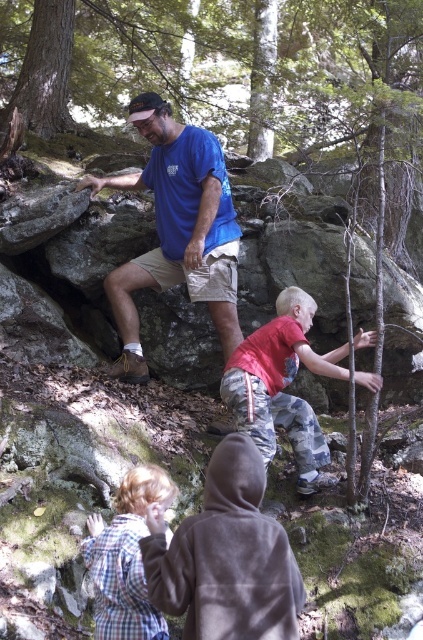
Question: Can you confirm if blue t-shirt at upper center is thinner than plaid fabric shirt at lower left?

Choices:
 (A) yes
 (B) no

Answer: (B)

Question: Which of the following is the closest to the observer?

Choices:
 (A) (85, 548)
 (B) (282, 387)

Answer: (A)

Question: Is blue t-shirt at upper center above plaid fabric shirt at lower left?

Choices:
 (A) no
 (B) yes

Answer: (B)

Question: Estimate the real-world distances between objects in this image. Which object is closer to the blue t-shirt at upper center?

Choices:
 (A) plaid fabric shirt at lower left
 (B) camouflage pants at center

Answer: (B)

Question: Is the position of blue t-shirt at upper center more distant than that of camouflage pants at center?

Choices:
 (A) no
 (B) yes

Answer: (B)

Question: Among these points, which one is nearest to the camera?

Choices:
 (A) (143, 632)
 (B) (206, 200)

Answer: (A)